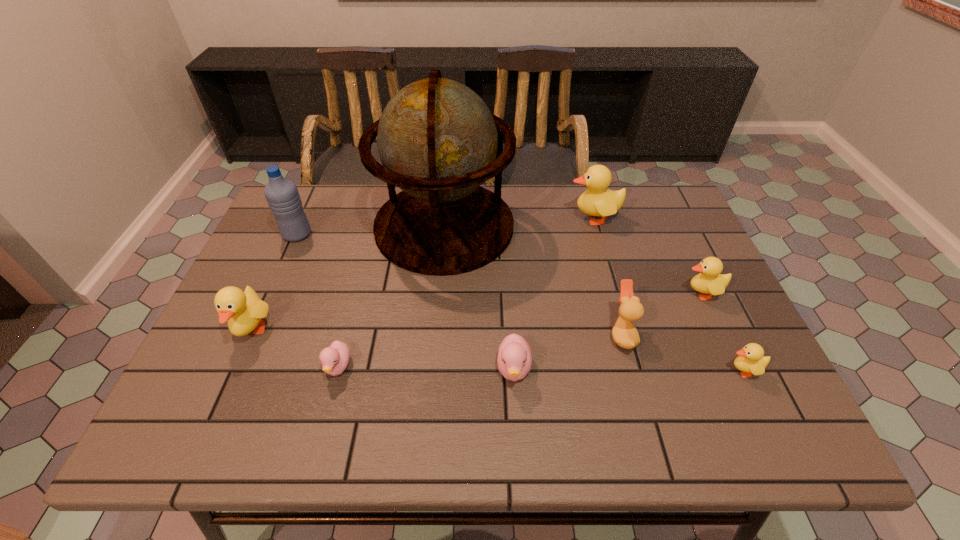
At what (x,y) coordinates should I click in order to perform the action: click on free space that satisfies the following two spatial constraints: 1. on the beak of the tan duck; 2. on the front-facing side of the smaller pink duckling. Please return your answer as a coordinate pair (x, y). Looking at the image, I should click on (631, 367).

Locate an element on the screen. The width and height of the screenshot is (960, 540). vacant space that satisfies the following two spatial constraints: 1. on the front-facing side of the fourth farthest object; 2. on the front-facing side of the fifth duckling from right to left is located at coordinates (735, 367).